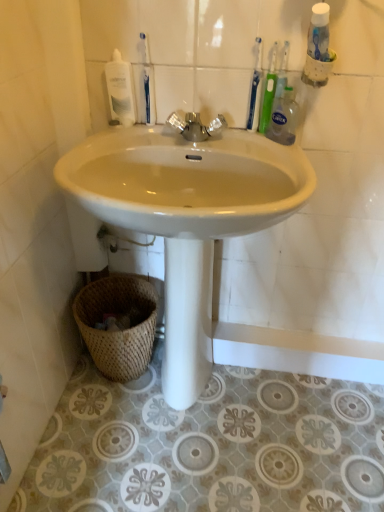
You are a GUI agent. You are given a task and a screenshot of the screen. Output one action in this format:
    pyautogui.click(x=<x>, y=<y>)
    Task: Click on the free point in front of clear plastic bottle at upper right
    
    Given the screenshot: What is the action you would take?
    coord(286,157)